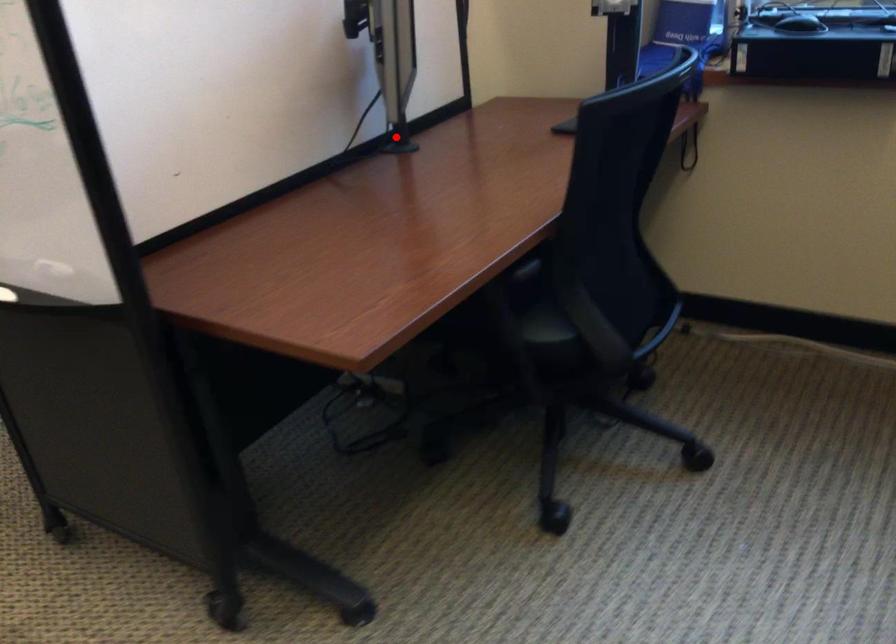
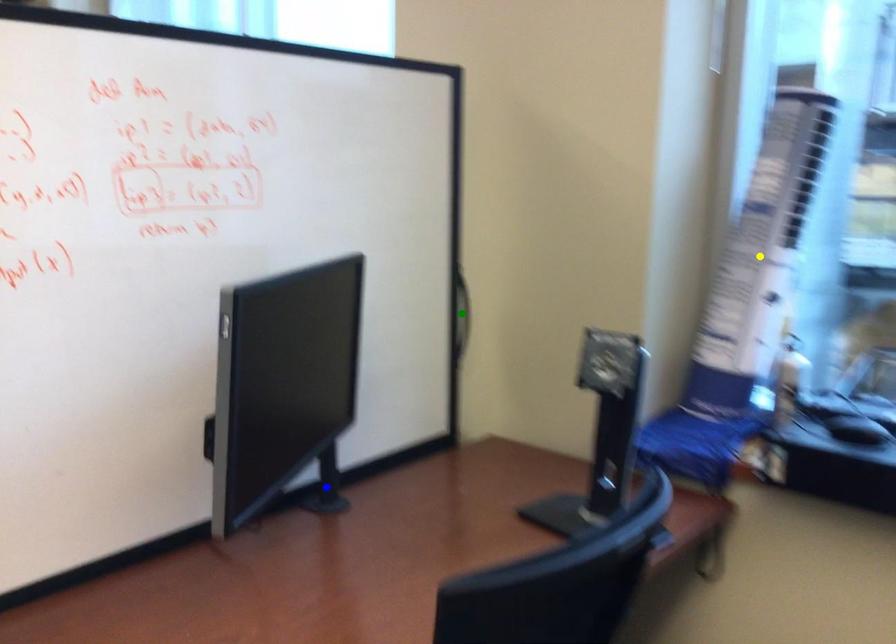
Question: I am providing you with two images of the same scene from different viewpoints. A red point is marked on the first image. You are given multiple points on the second image. Which spot in image 2 lines up with the point in image 1?

Choices:
 (A) blue point
 (B) yellow point
 (C) green point

Answer: (A)